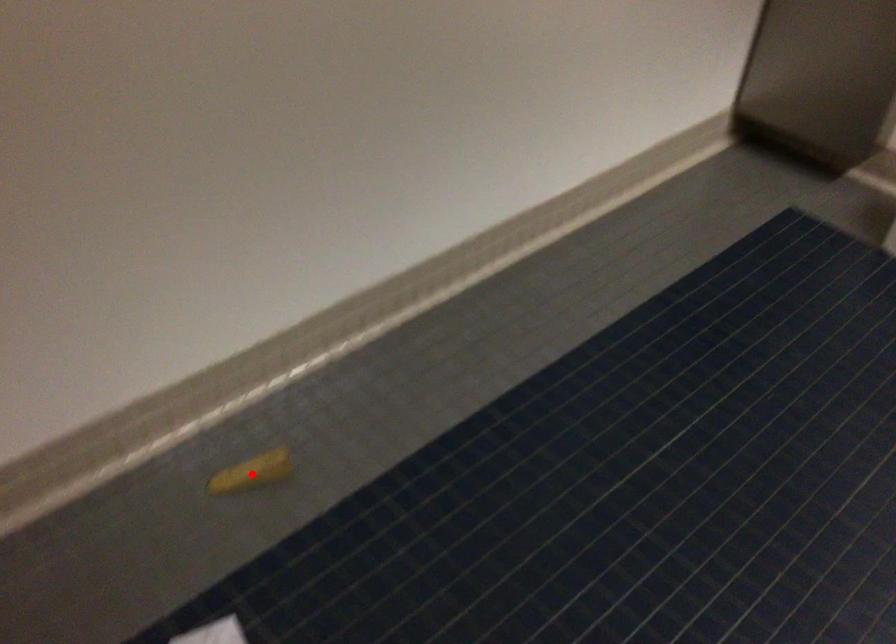
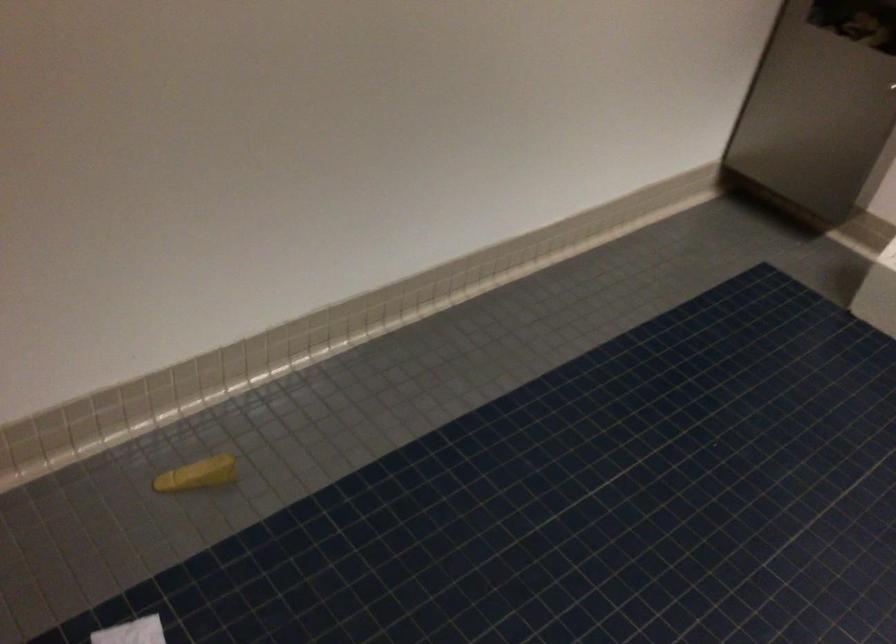
Where in the second image is the point corresponding to the highlighted location from the first image?

(197, 474)